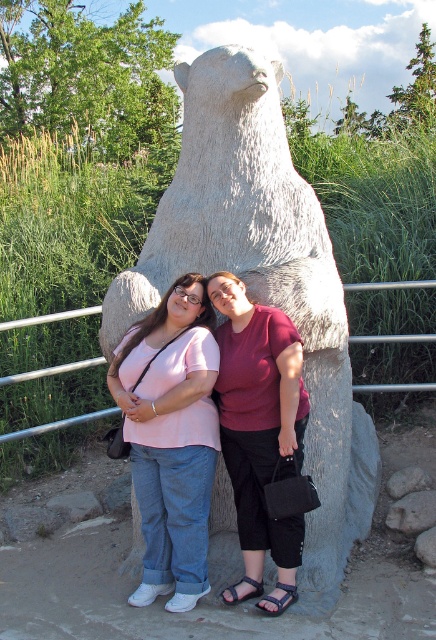
Looking at this image, you are trying to take a photo of the white stone bear at center and the matte pink shirt at center. Which object is closer to the camera?

The white stone bear at center is positioned over the matte pink shirt at center, so it is closer to the camera.

You are trying to take a photo of the white stone bear at center and the matte pink shirt at center. Since the bear is larger, would you need to adjust your camera settings to ensure both are in focus?

The white stone bear at center is larger than the matte pink shirt at center, so you should adjust your camera to focus on the bear first and then ensure the smaller matte pink shirt at center is also in focus by using a wider depth of field.

You are a photographer trying to adjust the composition of this photo. You want to ensure both the matte pink shirt at center and the matte red shirt at center are clearly visible. Which shirt should you focus on first to avoid blurring, considering their positions?

The matte pink shirt at center is below the matte red shirt at center, so focusing on the matte red shirt at center first would ensure both are in focus as the matte pink shirt is closer to the camera.